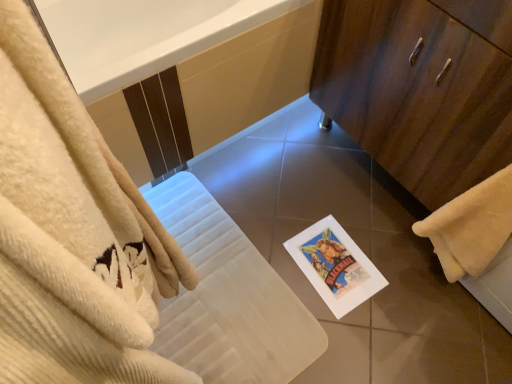
Identify the location of vacant area located to the right-hand side of white paper postcard at center. The image size is (512, 384). (395, 268).